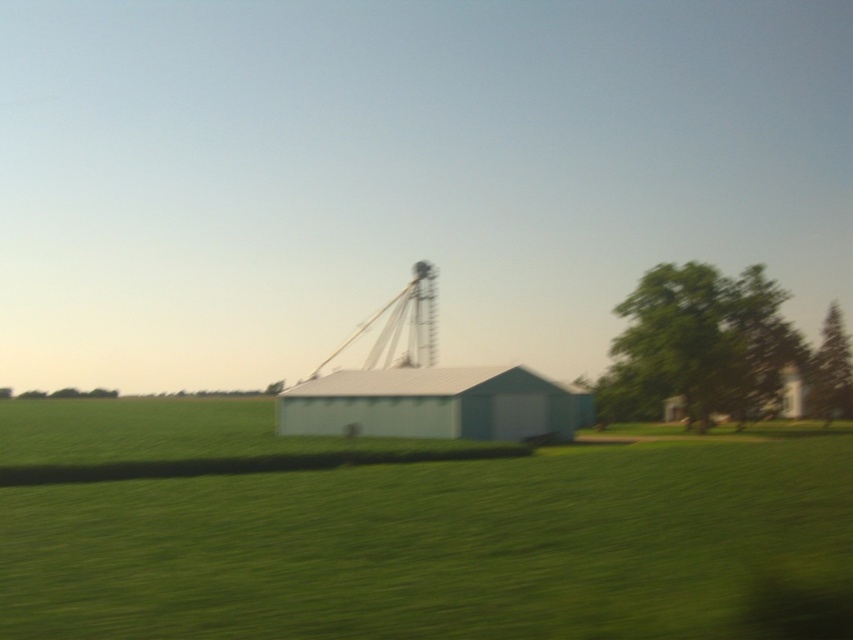
Which of these two, green grass at center or white corrugated metal barn at center, stands taller?

green grass at center is taller.

What do you see at coordinates (450, 547) in the screenshot?
I see `green grass at center` at bounding box center [450, 547].

Does point (463, 600) lie behind point (480, 385)?

No, it is in front of (480, 385).

What are the coordinates of `green grass at center` in the screenshot? It's located at pos(450,547).

Which is below, green leafy tree at right or white corrugated metal barn at center?

Result: white corrugated metal barn at center is lower down.

Does point (668, 310) lie in front of point (427, 433)?

No, (668, 310) is further to viewer.

At what (x,y) coordinates should I click in order to perform the action: click on green leafy tree at right. Please return your answer as a coordinate pair (x, y). Looking at the image, I should click on (698, 346).

Does green grass at center have a lesser height compared to green textured tree at right?

Yes.

Who is taller, green grass at center or green textured tree at right?

With more height is green textured tree at right.

Which is behind, point (563, 504) or point (833, 390)?

The point (833, 390) is more distant.

I want to click on green grass at center, so click(x=450, y=547).